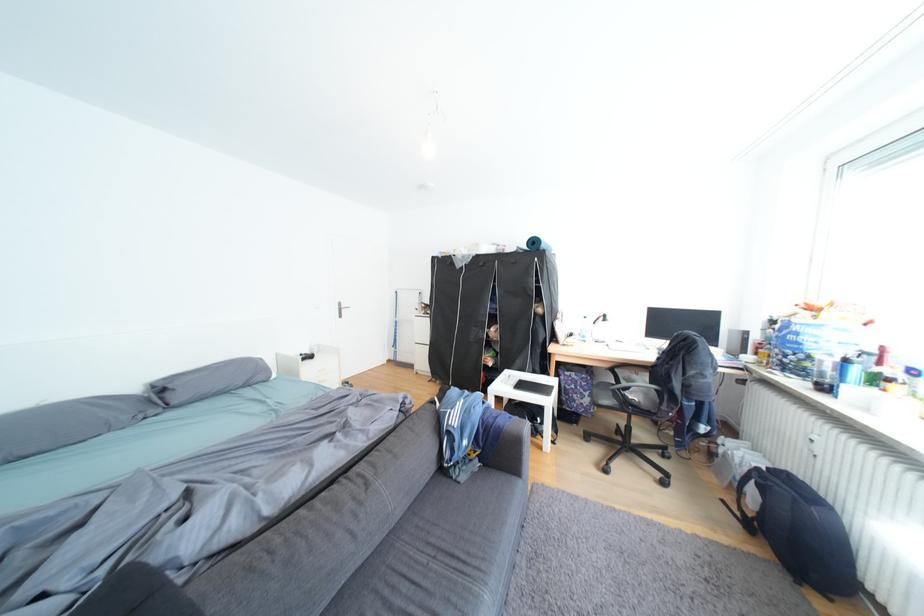
Where is `red bottle pump`? The image size is (924, 616). red bottle pump is located at coordinates (881, 355).